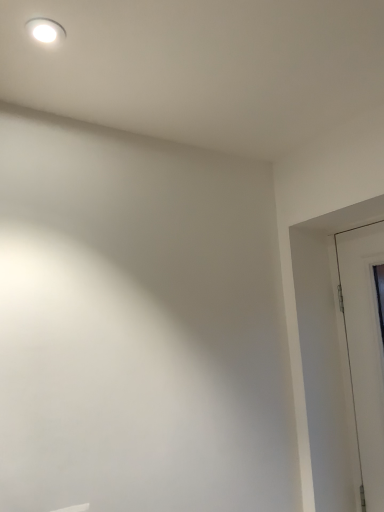
Question: Is white glossy light fixture at upper left situated inside white glossy door at right or outside?

Choices:
 (A) inside
 (B) outside

Answer: (B)

Question: Visually, is white glossy light fixture at upper left positioned to the left or to the right of white glossy door at right?

Choices:
 (A) left
 (B) right

Answer: (A)

Question: From a real-world perspective, is white glossy light fixture at upper left positioned above or below white glossy door at right?

Choices:
 (A) below
 (B) above

Answer: (B)

Question: In terms of size, does white glossy door at right appear bigger or smaller than white glossy light fixture at upper left?

Choices:
 (A) small
 (B) big

Answer: (B)

Question: Choose the correct answer: Is white glossy door at right inside white glossy light fixture at upper left or outside it?

Choices:
 (A) inside
 (B) outside

Answer: (B)

Question: Is point (357, 276) closer or farther from the camera than point (59, 39)?

Choices:
 (A) farther
 (B) closer

Answer: (A)

Question: From a real-world perspective, is white glossy door at right positioned above or below white glossy light fixture at upper left?

Choices:
 (A) above
 (B) below

Answer: (B)